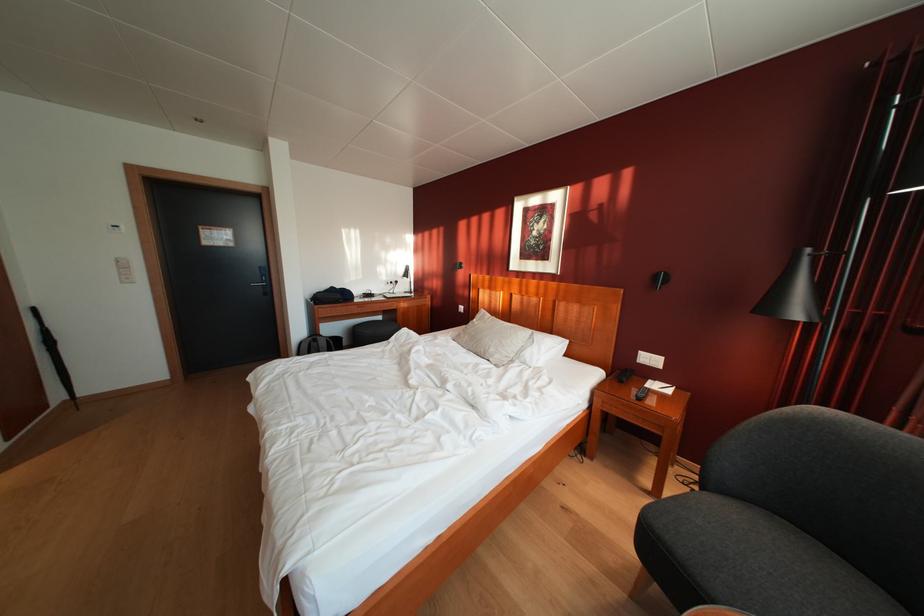
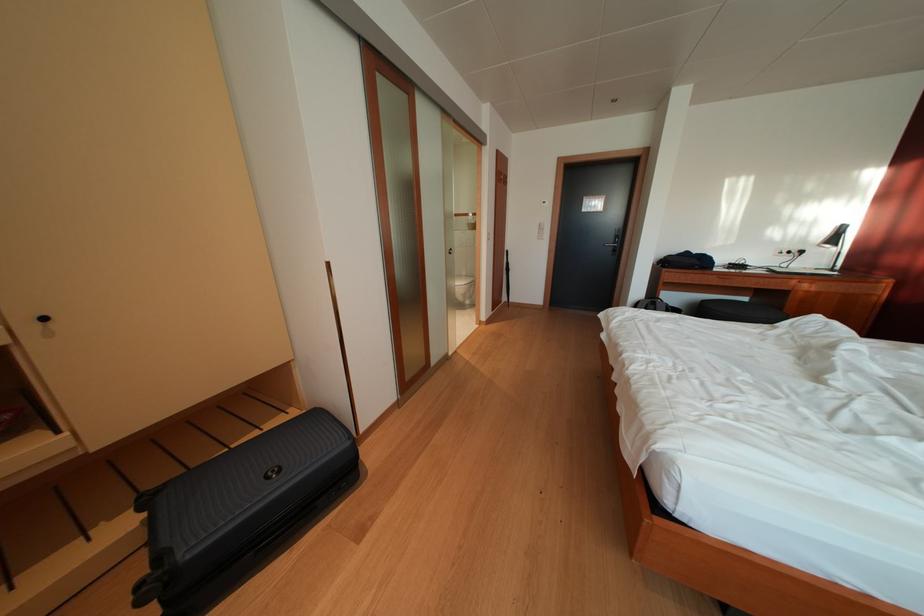
Where in the second image is the point corresponding to pixel 415 281 from the first image?

(842, 246)